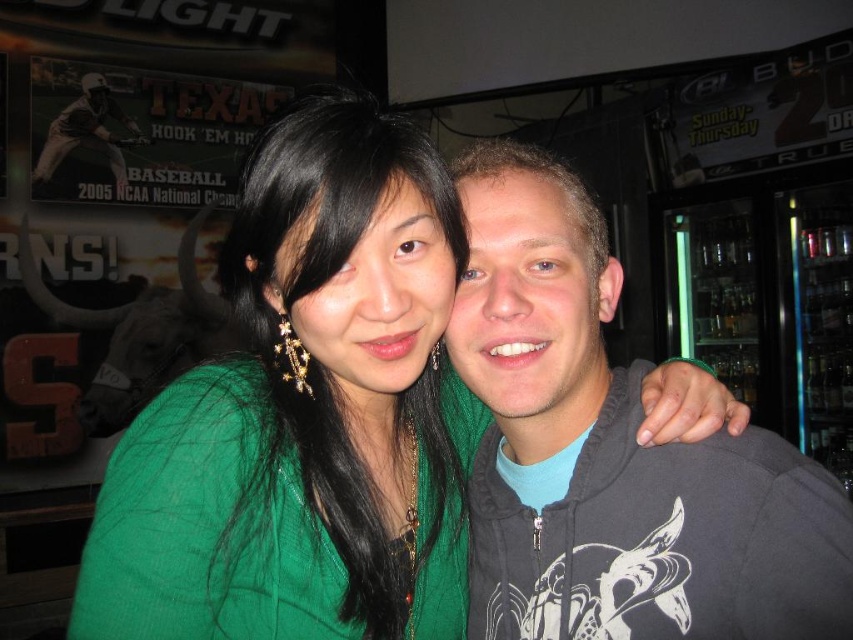
You are standing in front of the bar scene described. You need to place a small decorative item exactly at the position of the green fabric at center. What are the coordinates where you should place it?

The green fabric at center is located at point (305, 413), so you should place the decorative item at those coordinates.

You are a photographer trying to capture a group photo. You notice the green fabric at center and the dark gray hoodie at right in the frame. Which object should you adjust to ensure both are equally visible? Explain your reasoning.

The green fabric at center is bigger than the dark gray hoodie at right. To make both equally visible, you should reduce the size of the green fabric at center or increase the size of the dark gray hoodie at right in the frame.

You are standing in a bar and want to take a photo of the green fabric at center and the dark gray hoodie at right. Which object should you focus on first if you want to capture both in the same frame without moving the camera?

You should focus on the green fabric at center first because it is positioned to the left of the dark gray hoodie at right, so keeping both in frame requires starting with the leftmost object to ensure the right side also stays within the camera view.